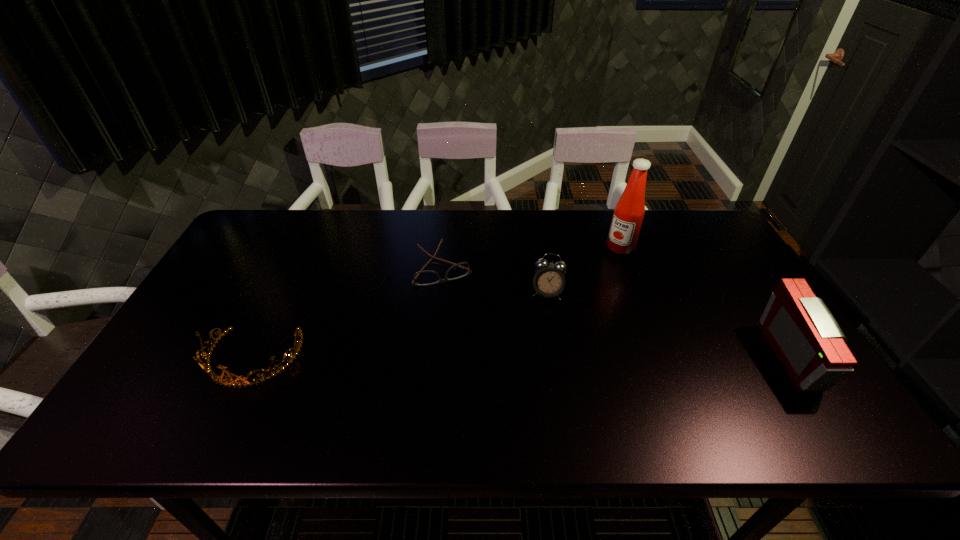
I want to click on free space located on the face of the alarm clock, so point(537,379).

Locate an element on the screen. Image resolution: width=960 pixels, height=540 pixels. free space located 0.050m on the face of the alarm clock is located at coordinates point(544,315).

Find the location of a particular element. vacant position located on the face of the alarm clock is located at coordinates (543, 320).

You are a GUI agent. You are given a task and a screenshot of the screen. Output one action in this format:
    pyautogui.click(x=<x>, y=<y>)
    Task: Click on the blank area located 0.280m on the front-facing side of the spectacles
    This screenshot has width=960, height=540.
    Given the screenshot: What is the action you would take?
    (480, 360)

You are a GUI agent. You are given a task and a screenshot of the screen. Output one action in this format:
    pyautogui.click(x=<x>, y=<y>)
    Task: Click on the free space located 0.260m on the front-facing side of the spectacles
    The height and width of the screenshot is (540, 960).
    Given the screenshot: What is the action you would take?
    pyautogui.click(x=477, y=354)

Image resolution: width=960 pixels, height=540 pixels. What are the coordinates of `vacant space located on the front-facing side of the spectacles` in the screenshot? It's located at (486, 376).

At what (x,y) coordinates should I click in order to perform the action: click on vacant space located on the front-facing side of the condiment. Please return your answer as a coordinate pair (x, y). The height and width of the screenshot is (540, 960). Looking at the image, I should click on (597, 269).

I want to click on free space located 0.070m on the front-facing side of the condiment, so click(602, 264).

Find the location of a particular element. The image size is (960, 540). free space located on the front-facing side of the condiment is located at coordinates (569, 294).

Identify the location of spectacles positioned at the far edge. (424, 277).